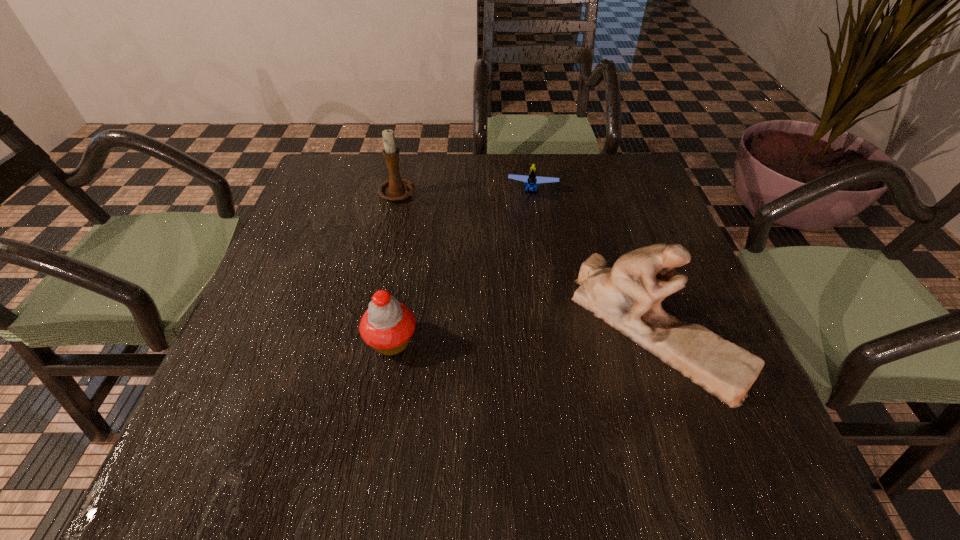
Locate an element on the screen. Image resolution: width=960 pixels, height=540 pixels. free space on the desktop that is between the cupcake and the figurine and is positioned on the front-facing side of the Lego is located at coordinates (519, 335).

This screenshot has height=540, width=960. Identify the location of vacant space on the desktop that is between the cupcake and the figurine and is positioned on the side of the candle holder with the handle. 532,335.